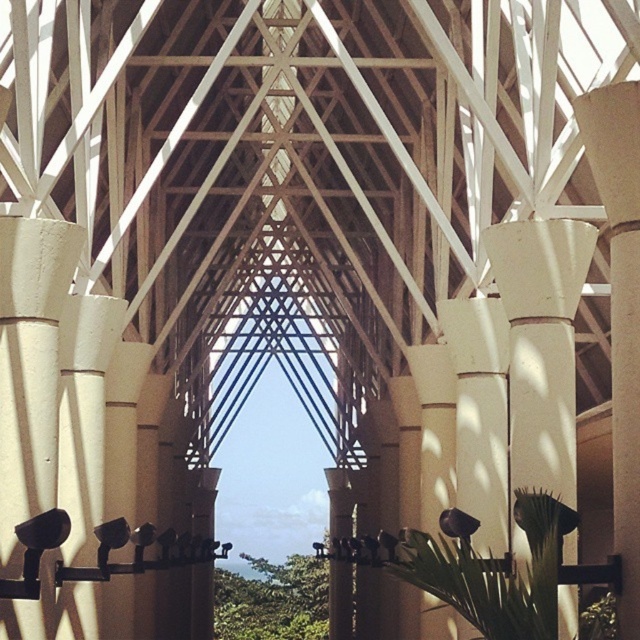
Question: Does white concrete column at center lie behind white smooth column at right?

Choices:
 (A) no
 (B) yes

Answer: (B)

Question: Can you confirm if white concrete column at center is thinner than white smooth column at right?

Choices:
 (A) no
 (B) yes

Answer: (B)

Question: Does white concrete column at center have a smaller size compared to white smooth column at right?

Choices:
 (A) no
 (B) yes

Answer: (B)

Question: Among these objects, which one is nearest to the camera?

Choices:
 (A) white smooth column at right
 (B) white concrete column at center

Answer: (A)

Question: Which point is closer to the camera?

Choices:
 (A) (627, 483)
 (B) (524, 397)

Answer: (A)